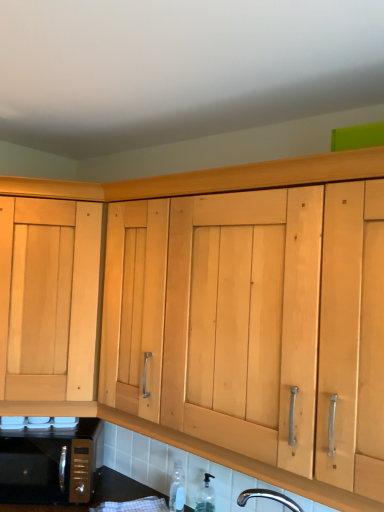
Question: Is clear glass bottle at lower center, marked as the second bottle in a left-to-right arrangement, situated inside light wood cabinet at left or outside?

Choices:
 (A) inside
 (B) outside

Answer: (B)

Question: From a real-world perspective, is clear glass bottle at lower center, marked as the second bottle in a left-to-right arrangement, positioned above or below light wood cabinet at left?

Choices:
 (A) above
 (B) below

Answer: (B)

Question: Which object is positioned farthest from the black metallic microwave at lower left?

Choices:
 (A) light wood cabinet at left
 (B) transparent plastic bottle at lower center, acting as the second bottle starting from the right
 (C) clear glass bottle at lower center, marked as the second bottle in a left-to-right arrangement

Answer: (C)

Question: Estimate the real-world distances between objects in this image. Which object is farther from the light wood cabinet at left?

Choices:
 (A) transparent plastic bottle at lower center, acting as the second bottle starting from the right
 (B) clear glass bottle at lower center, marked as the second bottle in a left-to-right arrangement
 (C) black metallic microwave at lower left

Answer: (B)